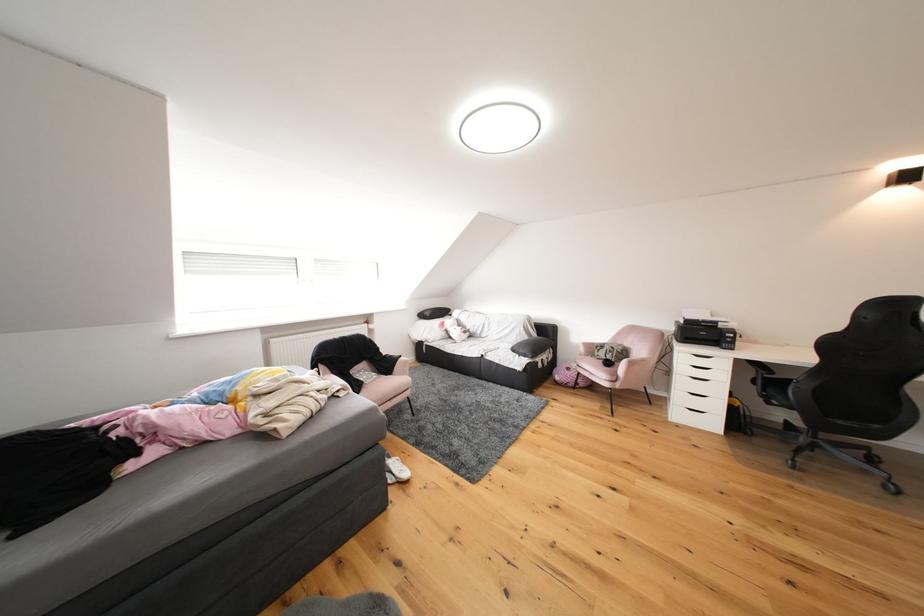
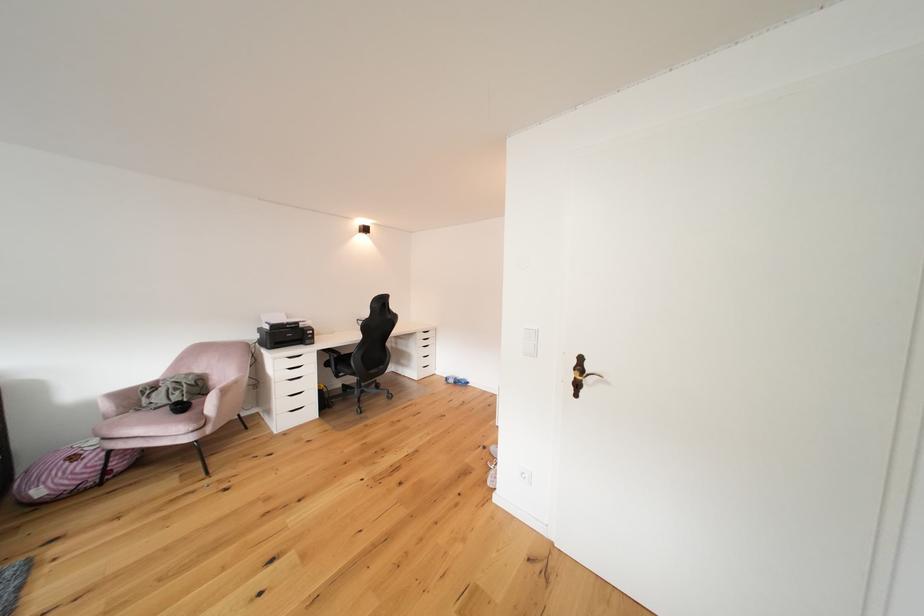
Locate, in the second image, the point that corresponds to (x=636, y=347) in the first image.

(208, 374)